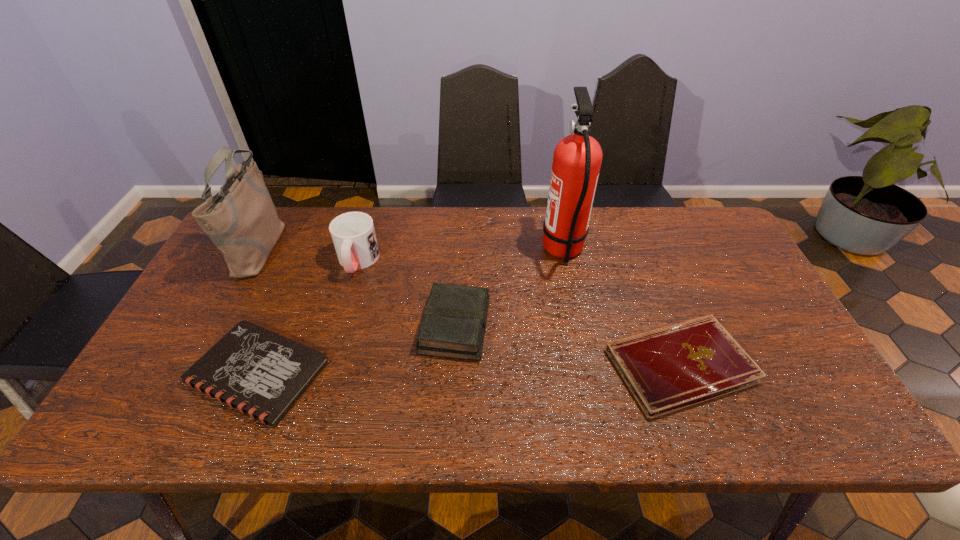
The image size is (960, 540). What are the coordinates of `object that is positioned at the right edge` in the screenshot? It's located at (667, 369).

You are a GUI agent. You are given a task and a screenshot of the screen. Output one action in this format:
    pyautogui.click(x=<x>, y=<y>)
    Task: Click on the object situated at the far left corner
    The height and width of the screenshot is (540, 960).
    Given the screenshot: What is the action you would take?
    pyautogui.click(x=241, y=220)

In order to click on object present at the near left corner in this screenshot , I will do `click(261, 373)`.

Where is `object located at the near right corner`? object located at the near right corner is located at coordinates (667, 369).

You are a GUI agent. You are given a task and a screenshot of the screen. Output one action in this format:
    pyautogui.click(x=<x>, y=<y>)
    Task: Click on the free space at the far edge
    Image resolution: width=960 pixels, height=540 pixels.
    Given the screenshot: What is the action you would take?
    pyautogui.click(x=538, y=253)

Locate an element on the screen. This screenshot has height=540, width=960. free space at the near edge of the desktop is located at coordinates (381, 406).

What are the coordinates of `free space at the left edge of the desktop` in the screenshot? It's located at (187, 319).

You are a GUI agent. You are given a task and a screenshot of the screen. Output one action in this format:
    pyautogui.click(x=<x>, y=<y>)
    Task: Click on the free space at the right edge of the desktop
    
    Given the screenshot: What is the action you would take?
    pyautogui.click(x=704, y=274)

At what (x,y) coordinates should I click in order to perform the action: click on unoccupied position between the mug and the right notebook. Please return your answer as a coordinate pair (x, y). The image size is (960, 540). Looking at the image, I should click on (518, 314).

This screenshot has height=540, width=960. In order to click on empty space between the right notebook and the tallest object in this screenshot , I will do `click(621, 308)`.